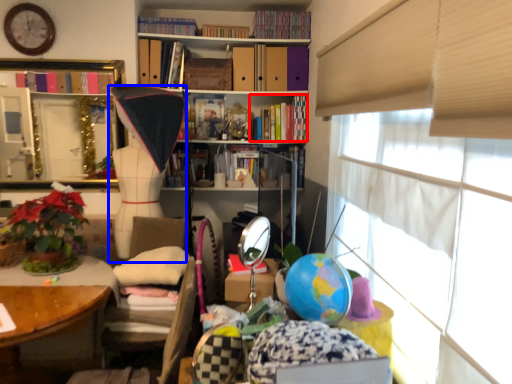
Question: Which object appears farthest to the camera in this image, book (highlighted by a red box) or doll (highlighted by a blue box)?

Choices:
 (A) book
 (B) doll

Answer: (A)